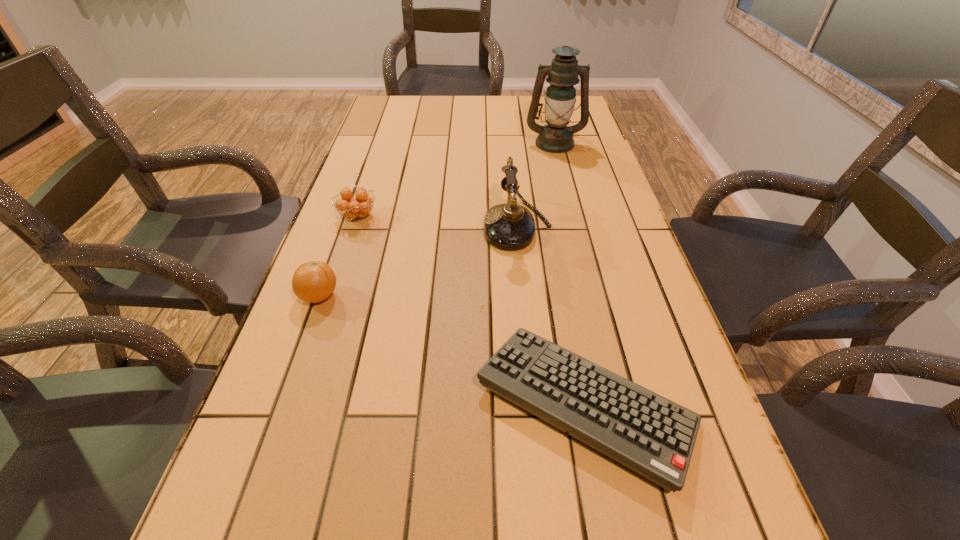
Find the location of a particular element. vacant space that is in between the nearest object and the nearer orange fruit is located at coordinates (452, 350).

Locate an element on the screen. vacant space that is in between the nearer orange fruit and the telephone is located at coordinates (419, 261).

At what (x,y) coordinates should I click in order to perform the action: click on free point between the telephone and the farther orange fruit. Please return your answer as a coordinate pair (x, y). The width and height of the screenshot is (960, 540). Looking at the image, I should click on (438, 221).

At what (x,y) coordinates should I click in order to perform the action: click on free space that is in between the fourth shortest object and the nearer orange fruit. Please return your answer as a coordinate pair (x, y). Looking at the image, I should click on (419, 261).

Find the location of a particular element. This screenshot has height=540, width=960. vacant point located between the fourth shortest object and the second nearest object is located at coordinates pos(419,261).

In order to click on vacant area between the farther orange fruit and the tallest object in this screenshot , I will do `click(456, 179)`.

The width and height of the screenshot is (960, 540). Identify the location of vacant area between the nearer orange fruit and the farther orange fruit. (339, 256).

Find the location of a particular element. free space between the telephone and the farther orange fruit is located at coordinates (438, 221).

Where is `free spot between the nearest object and the farther orange fruit`? free spot between the nearest object and the farther orange fruit is located at coordinates (471, 310).

The width and height of the screenshot is (960, 540). In order to click on vacant space that's between the farther orange fruit and the oil lamp in this screenshot , I will do `click(456, 179)`.